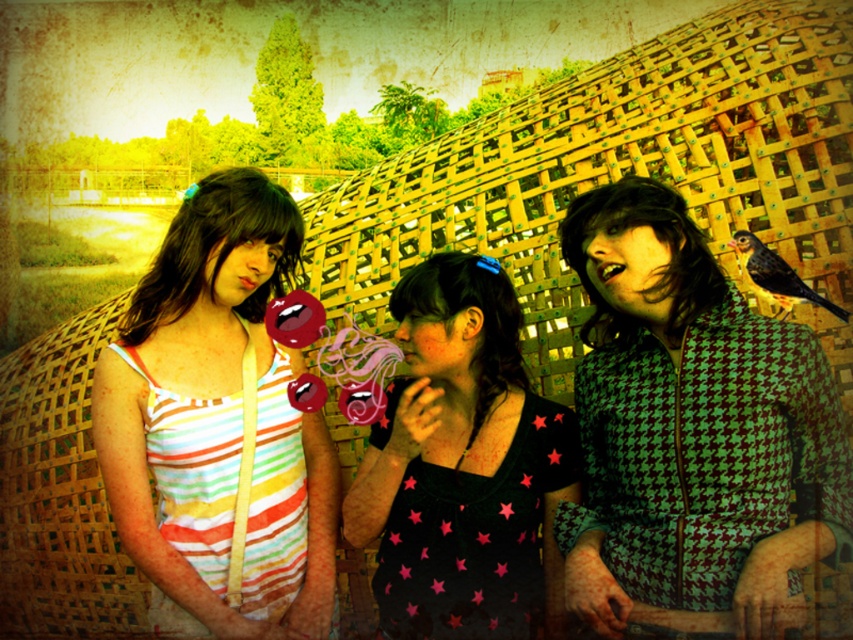
Question: Estimate the real-world distances between objects in this image. Which object is farther from the striped fabric dress at left?

Choices:
 (A) green houndstooth coat at center
 (B) black star-patterned shirt at center

Answer: (A)

Question: Where is striped fabric dress at left located in relation to black star-patterned shirt at center in the image?

Choices:
 (A) right
 (B) left

Answer: (B)

Question: Which point appears farthest from the camera in this image?

Choices:
 (A) (202, 436)
 (B) (378, 529)

Answer: (A)

Question: Is striped fabric dress at left further to the viewer compared to black star-patterned shirt at center?

Choices:
 (A) no
 (B) yes

Answer: (B)

Question: Which point is farther from the camera taking this photo?

Choices:
 (A) (717, 506)
 (B) (328, 468)

Answer: (B)

Question: Where is green houndstooth coat at center located in relation to striped fabric dress at left in the image?

Choices:
 (A) below
 (B) above

Answer: (B)